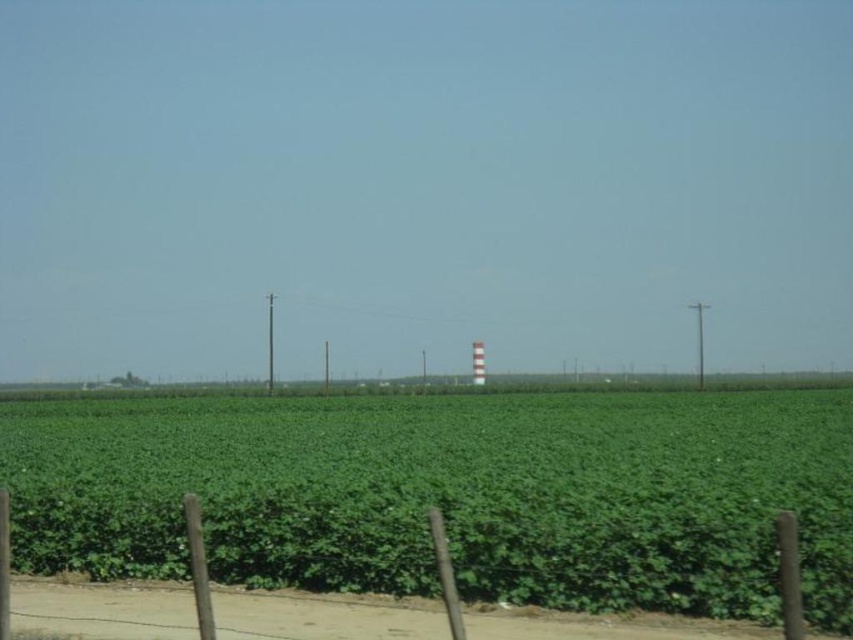
Based on the photo, you are a farmer checking the field layout. You need to know which object is wider between the green leafy field at center and the smooth wood pole at center. Which one is wider?

The green leafy field at center is wider than the smooth wood pole at center according to the description.

From the picture: You are standing at the edge of the green leafy field at center and looking towards the smooth wood pole at center. Which object is closer to you?

The green leafy field at center is closer to you since it is in front of the smooth wood pole at center.